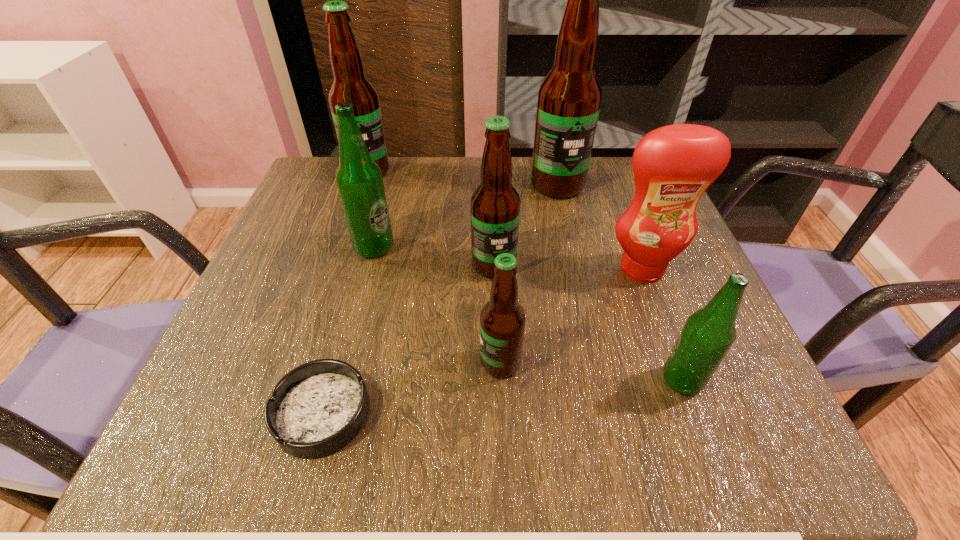
The height and width of the screenshot is (540, 960). What are the coordinates of `the closest beer bottle to the dark ashtray` in the screenshot? It's located at (502, 320).

Locate an element on the screen. brown beer bottle that stands as the closest to the shortest object is located at coordinates (502, 320).

Locate an element on the screen. brown beer bottle that stands as the second closest to the farther green beer bottle is located at coordinates (350, 85).

Where is `vacant space that satisfies the following two spatial constraints: 1. on the label of the fifth beer bottle from left to right; 2. on the label of the bigger green beer bottle`? Image resolution: width=960 pixels, height=540 pixels. vacant space that satisfies the following two spatial constraints: 1. on the label of the fifth beer bottle from left to right; 2. on the label of the bigger green beer bottle is located at coordinates (571, 247).

Where is `free location that satisfies the following two spatial constraints: 1. on the label side of the red condiment; 2. on the label of the rightmost beer bottle`? Image resolution: width=960 pixels, height=540 pixels. free location that satisfies the following two spatial constraints: 1. on the label side of the red condiment; 2. on the label of the rightmost beer bottle is located at coordinates pyautogui.click(x=684, y=381).

Identify the location of vacant space that satisfies the following two spatial constraints: 1. on the label of the second beer bottle from right to left; 2. on the label of the nearest brown beer bottle. (596, 362).